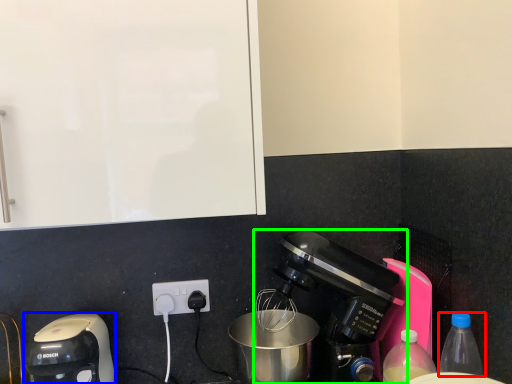
Question: Estimate the real-world distances between objects in this image. Which object is farther from bottle (highlighted by a red box), coffee maker (highlighted by a blue box) or coffee maker (highlighted by a green box)?

Choices:
 (A) coffee maker
 (B) coffee maker

Answer: (A)